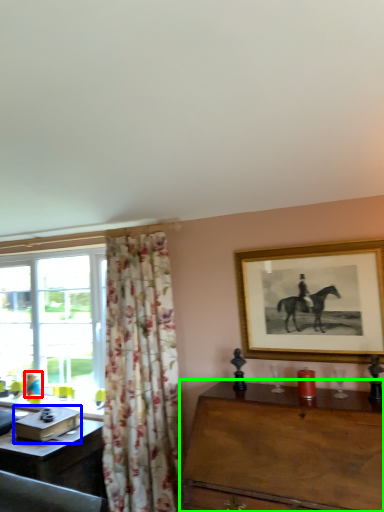
Question: Which is nearer to the person (highlighted by a red box)? box (highlighted by a blue box) or table (highlighted by a green box).

Choices:
 (A) box
 (B) table

Answer: (A)